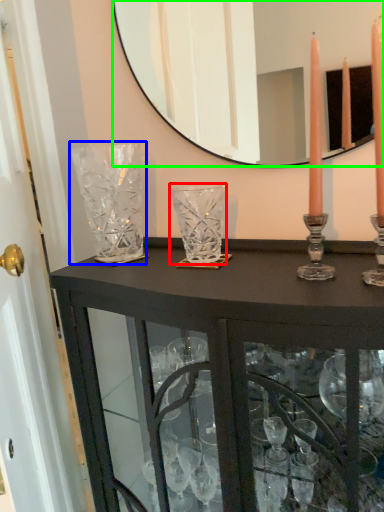
Question: Which object is the closest to the glass vase (highlighted by a red box)? Choose among these: glass vase (highlighted by a blue box) or mirror (highlighted by a green box).

Choices:
 (A) glass vase
 (B) mirror

Answer: (A)